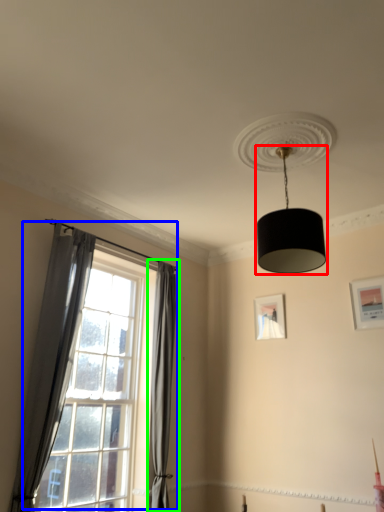
Question: Which is nearer to the lamp (highlighted by a red box)? window (highlighted by a blue box) or curtain (highlighted by a green box).

Choices:
 (A) window
 (B) curtain

Answer: (B)